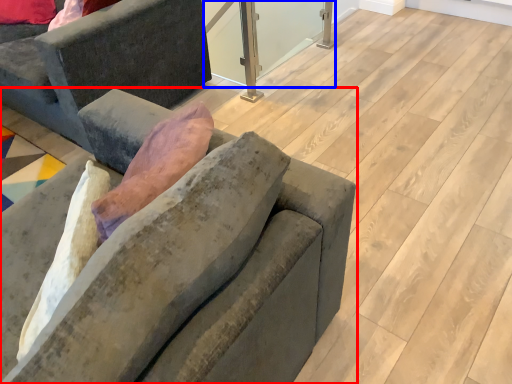
Question: Which object appears farthest to the camera in this image, studio couch (highlighted by a red box) or window screen (highlighted by a blue box)?

Choices:
 (A) studio couch
 (B) window screen

Answer: (B)